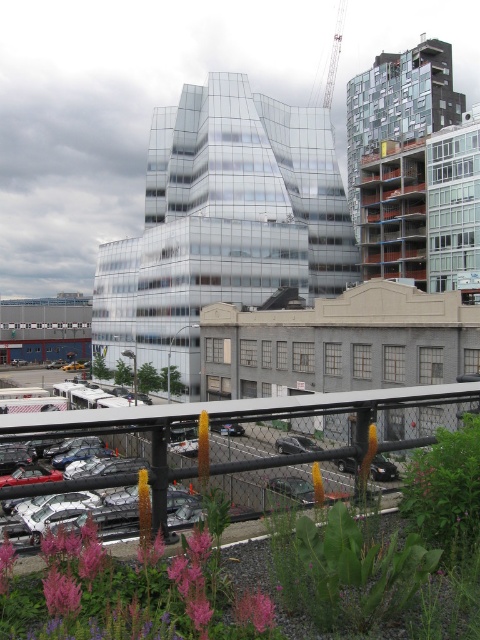
Question: Is shiny black sedan at center smaller than orange fuzzy flower at center?

Choices:
 (A) no
 (B) yes

Answer: (B)

Question: Where is green concrete construction site at center located in relation to shiny black sedan at center in the image?

Choices:
 (A) left
 (B) right

Answer: (A)

Question: Among these points, which one is nearest to the camera?

Choices:
 (A) (370, 424)
 (B) (188, 577)
 (C) (319, 490)

Answer: (B)

Question: Observing the image, what is the correct spatial positioning of green concrete construction site at center in reference to metallic silver crane at upper center?

Choices:
 (A) right
 (B) left

Answer: (B)

Question: Which of these objects is positioned closest to the metallic silver crane at upper center?

Choices:
 (A) shiny black sedan at center
 (B) orange fuzzy flower at center

Answer: (A)

Question: Among these points, which one is farthest from the camera?

Choices:
 (A) (380, 68)
 (B) (367, 467)
 (C) (322, 481)
 (D) (340, 524)

Answer: (A)